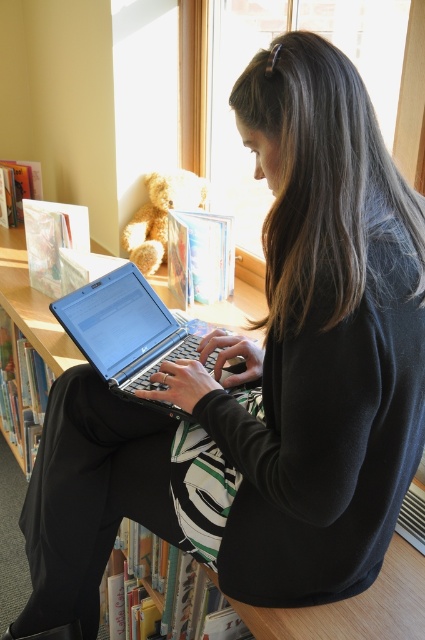
Question: Can you confirm if wooden bookcase at center is smaller than satin black laptop at center?

Choices:
 (A) yes
 (B) no

Answer: (B)

Question: Among these objects, which one is nearest to the camera?

Choices:
 (A) satin black laptop at center
 (B) wooden bookcase at center

Answer: (A)

Question: Is wooden bookcase at center smaller than satin black laptop at center?

Choices:
 (A) no
 (B) yes

Answer: (A)

Question: Does wooden bookcase at center lie in front of satin black laptop at center?

Choices:
 (A) yes
 (B) no

Answer: (B)